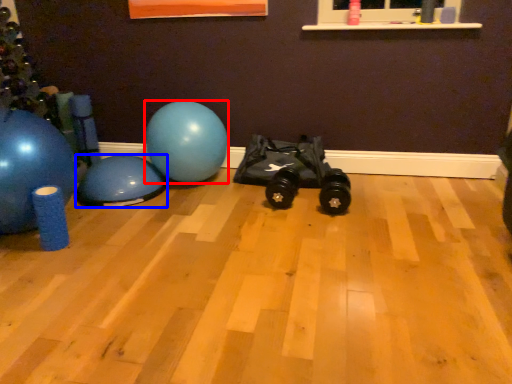
Question: Which point is further to the camera, ball (highlighted by a red box) or ball (highlighted by a blue box)?

Choices:
 (A) ball
 (B) ball

Answer: (A)